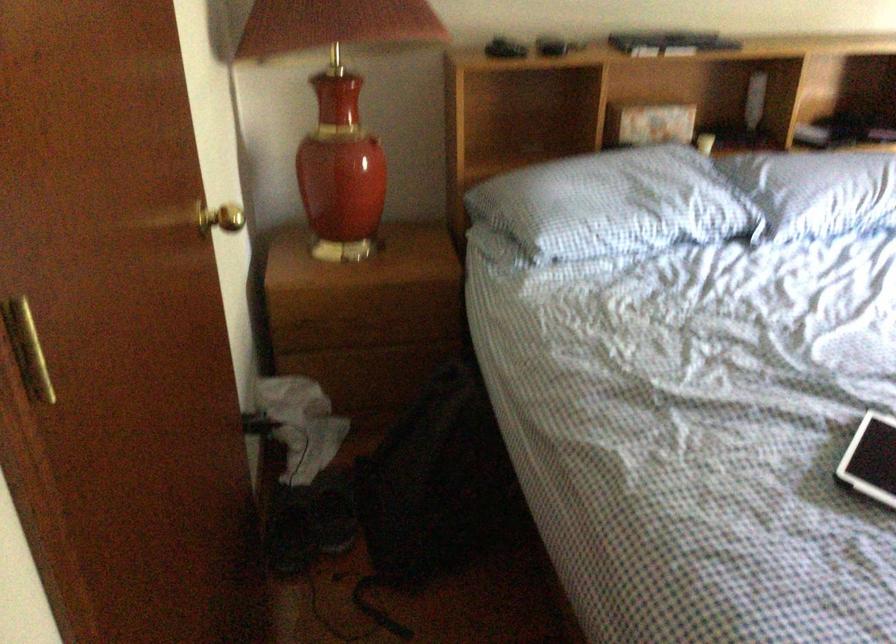
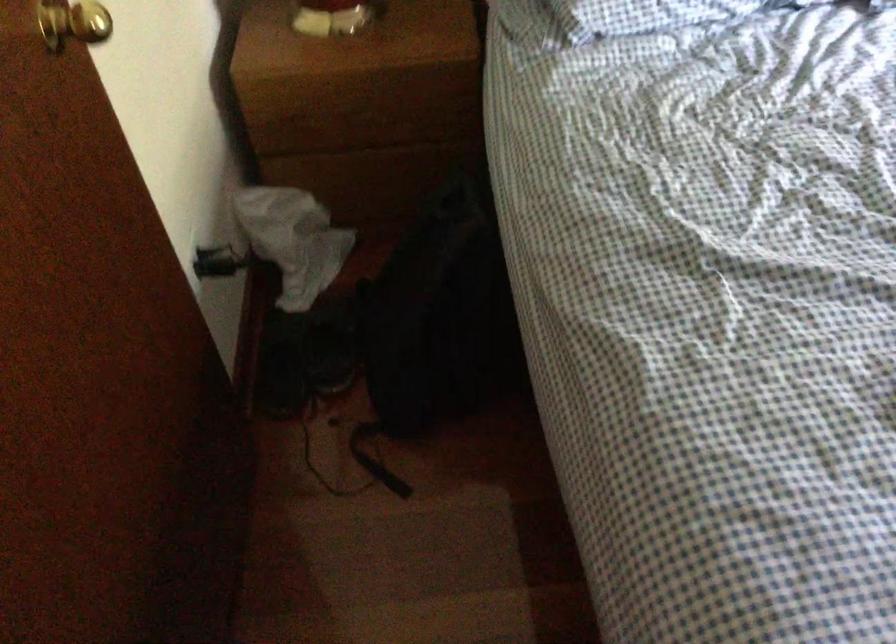
Question: Based on the continuous images, in which direction is the camera rotating? Reply with the corresponding letter.

Choices:
 (A) Left
 (B) Right
 (C) Up
 (D) Down

Answer: (D)